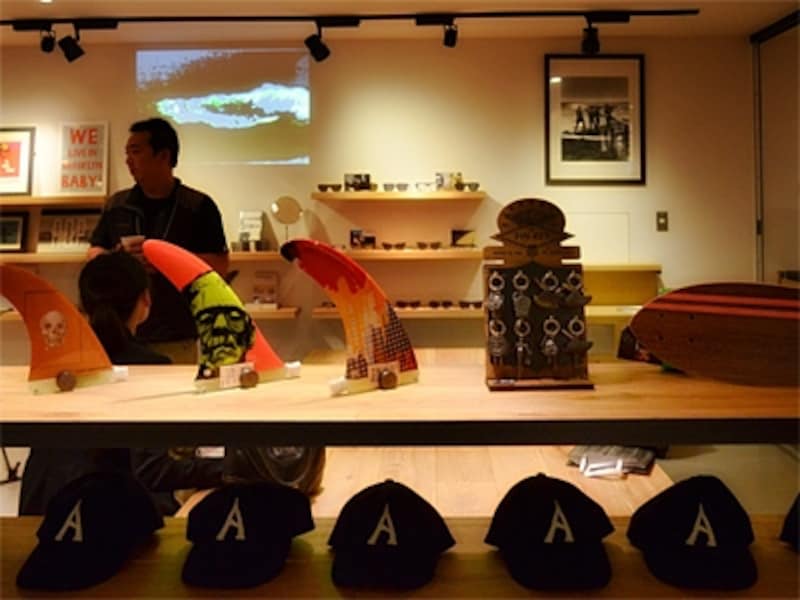
Where is `picture`? picture is located at coordinates pos(596,109), pos(17,159), pos(14,222).